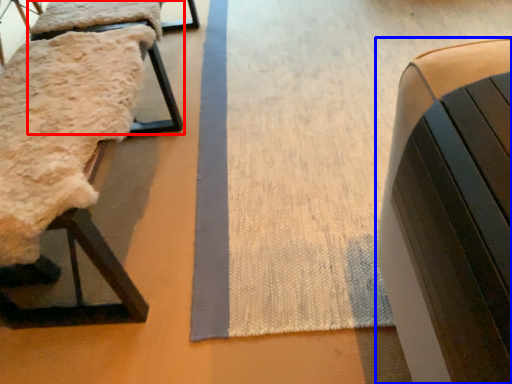
Question: Which point is further to the camera, furniture (highlighted by a red box) or furniture (highlighted by a blue box)?

Choices:
 (A) furniture
 (B) furniture

Answer: (A)